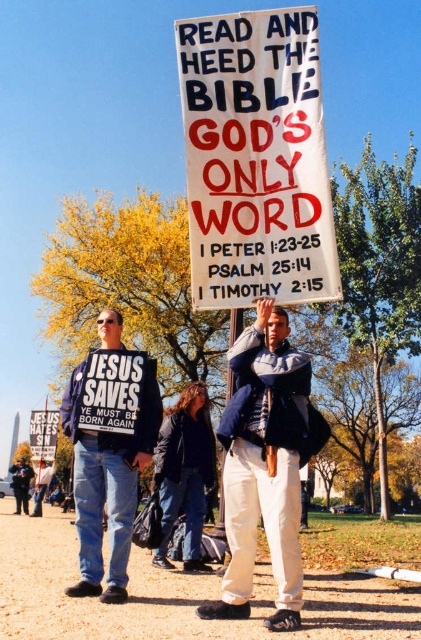
Does denim jacket at center appear on the right side of dark blue jacket at center?

Correct, you'll find denim jacket at center to the right of dark blue jacket at center.

Between denim jacket at center and dark blue jacket at center, which one is positioned lower?

dark blue jacket at center is lower down.

Who is more distant from viewer, (288, 381) or (181, 467)?

The point (181, 467) is more distant.

The height and width of the screenshot is (640, 421). I want to click on denim jacket at center, so click(266, 465).

Is white paper sign at center positioned before black cotton shirt at center?

Yes, white paper sign at center is closer to the viewer.

Can you confirm if white paper sign at center is positioned below black cotton shirt at center?

No, white paper sign at center is not below black cotton shirt at center.

Is point (304, 97) closer to viewer compared to point (96, 582)?

That is False.

Image resolution: width=421 pixels, height=640 pixels. Find the location of `white paper sign at center`. white paper sign at center is located at coordinates (255, 160).

Is point (205, 22) less distant than point (266, 328)?

That is False.

Is point (226, 205) more distant than point (264, 524)?

Yes.

Is point (231, 284) positioned behind point (269, 486)?

Yes, point (231, 284) is behind point (269, 486).

The width and height of the screenshot is (421, 640). Find the location of `white paper sign at center`. white paper sign at center is located at coordinates (255, 160).